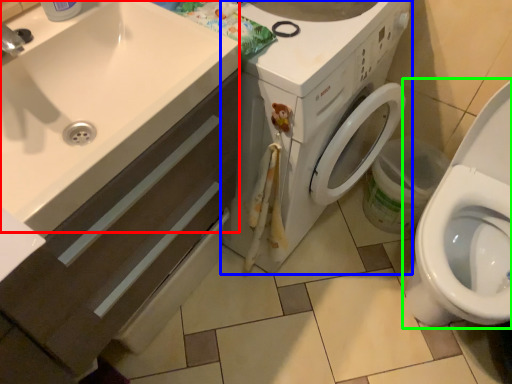
Question: Estimate the real-world distances between objects in this image. Which object is closer to sink (highlighted by a red box), washing machine (highlighted by a blue box) or toilet (highlighted by a green box)?

Choices:
 (A) washing machine
 (B) toilet

Answer: (A)